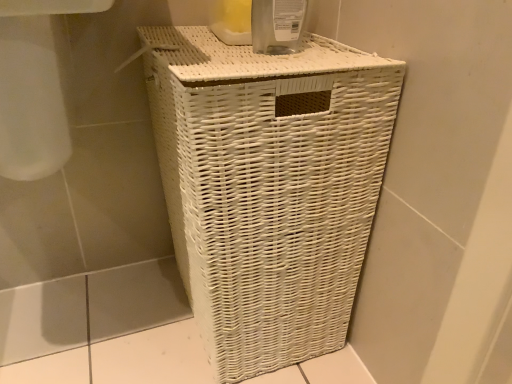
Locate an element on the screen. This screenshot has width=512, height=384. white wicker basket at center is located at coordinates (269, 187).

What do you see at coordinates (269, 187) in the screenshot? Image resolution: width=512 pixels, height=384 pixels. I see `white wicker basket at center` at bounding box center [269, 187].

What is the approximate height of white wicker basket at center?

The height of white wicker basket at center is 24.14 inches.

In order to face transparent plastic bottle at upper center, should I rotate leftwards or rightwards?

To face it directly, rotate right by 5.659 degrees.

This screenshot has height=384, width=512. Describe the element at coordinates (278, 26) in the screenshot. I see `transparent plastic bottle at upper center` at that location.

This screenshot has height=384, width=512. I want to click on transparent plastic bottle at upper center, so click(278, 26).

This screenshot has height=384, width=512. I want to click on white wicker basket at center, so click(269, 187).

Considering the relative positions of transparent plastic bottle at upper center and white wicker basket at center in the image provided, is transparent plastic bottle at upper center to the left or to the right of white wicker basket at center?

From the image, it's evident that transparent plastic bottle at upper center is to the right of white wicker basket at center.

Is the depth of transparent plastic bottle at upper center less than that of white wicker basket at center?

That is False.

Between point (304, 7) and point (319, 176), which one is positioned behind?

The point (304, 7) is more distant.

Based on the photo, from the image's perspective, would you say transparent plastic bottle at upper center is positioned over white wicker basket at center?

Correct, transparent plastic bottle at upper center appears higher than white wicker basket at center in the image.

In the scene shown: From a real-world perspective, is transparent plastic bottle at upper center above or below white wicker basket at center?

In terms of real-world spatial position, transparent plastic bottle at upper center is above white wicker basket at center.

Can you confirm if transparent plastic bottle at upper center is thinner than white wicker basket at center?

Correct, the width of transparent plastic bottle at upper center is less than that of white wicker basket at center.

Can you confirm if transparent plastic bottle at upper center is taller than white wicker basket at center?

No, transparent plastic bottle at upper center is not taller than white wicker basket at center.

Is transparent plastic bottle at upper center bigger or smaller than white wicker basket at center?

In the image, transparent plastic bottle at upper center appears to be smaller than white wicker basket at center.

Is white wicker basket at center inside transparent plastic bottle at upper center?

No, white wicker basket at center is not surrounded by transparent plastic bottle at upper center.

Is the surface of transparent plastic bottle at upper center in direct contact with white wicker basket at center?

No.

Is transparent plastic bottle at upper center looking in the opposite direction of white wicker basket at center?

No, white wicker basket at center is not at the back of transparent plastic bottle at upper center.

How different are the orientations of transparent plastic bottle at upper center and white wicker basket at center in degrees?

The facing directions of transparent plastic bottle at upper center and white wicker basket at center are 0.000565 degrees apart.

You are a GUI agent. You are given a task and a screenshot of the screen. Output one action in this format:
    pyautogui.click(x=<x>, y=<y>)
    Task: Click on the glass jar that appears behind the white wicker basket at center
    
    Given the screenshot: What is the action you would take?
    pyautogui.click(x=278, y=26)

Based on their positions, is white wicker basket at center located to the left or right of transparent plastic bottle at upper center?

From the image, it's evident that white wicker basket at center is to the left of transparent plastic bottle at upper center.

Is white wicker basket at center further to the viewer compared to transparent plastic bottle at upper center?

No, it is in front of transparent plastic bottle at upper center.

Does point (341, 244) lie behind point (271, 24)?

Yes.

From the image's perspective, would you say white wicker basket at center is shown under transparent plastic bottle at upper center?

Yes.

From a real-world perspective, who is located lower, white wicker basket at center or transparent plastic bottle at upper center?

In real-world perspective, white wicker basket at center is lower.

Consider the image. Which object is thinner, white wicker basket at center or transparent plastic bottle at upper center?

With smaller width is transparent plastic bottle at upper center.

Who is taller, white wicker basket at center or transparent plastic bottle at upper center?

With more height is white wicker basket at center.

Does white wicker basket at center have a smaller size compared to transparent plastic bottle at upper center?

Incorrect, white wicker basket at center is not smaller in size than transparent plastic bottle at upper center.

Is transparent plastic bottle at upper center completely or partially inside white wicker basket at center?

Actually, transparent plastic bottle at upper center is outside white wicker basket at center.

Is white wicker basket at center directly adjacent to transparent plastic bottle at upper center?

They are not placed beside each other.

Could you tell me if white wicker basket at center is facing transparent plastic bottle at upper center?

No, white wicker basket at center is not turned towards transparent plastic bottle at upper center.

How different are the orientations of white wicker basket at center and transparent plastic bottle at upper center in degrees?

white wicker basket at center and transparent plastic bottle at upper center are facing 0.000565 degrees away from each other.

This screenshot has height=384, width=512. Identify the location of waste container below the transparent plastic bottle at upper center (from the image's perspective). (269, 187).

This screenshot has width=512, height=384. I want to click on waste container located below the transparent plastic bottle at upper center (from the image's perspective), so click(269, 187).

Locate an element on the screen. Image resolution: width=512 pixels, height=384 pixels. glass jar behind the white wicker basket at center is located at coordinates (278, 26).